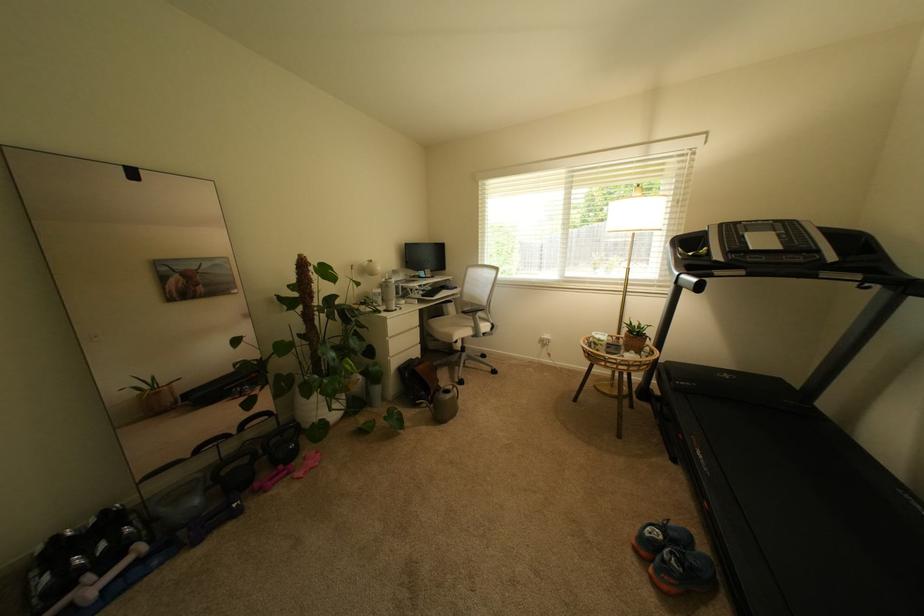
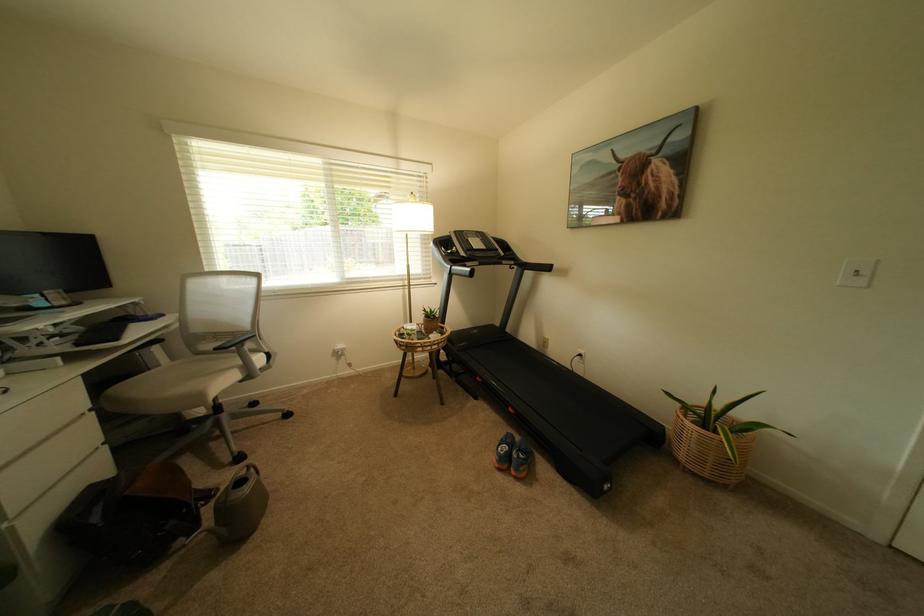
Question: The camera is either moving clockwise (left) or counter-clockwise (right) around the object. The first image is from the beginning of the video and the second image is from the end. Is the camera moving left or right when shooting the video?

Choices:
 (A) Left
 (B) Right

Answer: (A)